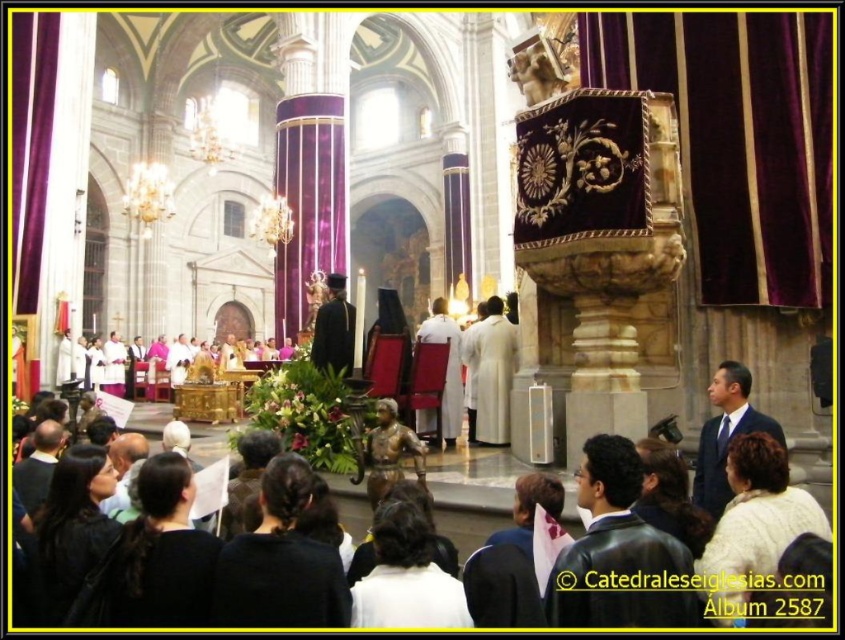
Between white matte robe at lower center and black velvet robe at center, which one appears on the left side from the viewer's perspective?

black velvet robe at center

Image resolution: width=845 pixels, height=640 pixels. I want to click on white matte robe at lower center, so click(407, 598).

Locate an element on the screen. This screenshot has height=640, width=845. white matte robe at lower center is located at coordinates (407, 598).

Is black leather jacket at lower center positioned behind black matte robe at lower left?

No, black leather jacket at lower center is in front of black matte robe at lower left.

Who is more forward, (601, 433) or (126, 605)?

Point (126, 605) is in front.

Which is in front, point (691, 620) or point (208, 557)?

Point (691, 620) is in front.

The height and width of the screenshot is (640, 845). In order to click on black leather jacket at lower center in this screenshot , I will do `click(619, 554)`.

Describe the element at coordinates (726, 435) in the screenshot. Image resolution: width=845 pixels, height=640 pixels. I see `dark blue suit at right` at that location.

Is dark blue suit at right bigger than dark brown leather jacket at lower left?

Correct, dark blue suit at right is larger in size than dark brown leather jacket at lower left.

Between point (715, 502) and point (52, 461), which one is positioned in front?

Point (715, 502) is more forward.

Find the location of a particular element. dark blue suit at right is located at coordinates (726, 435).